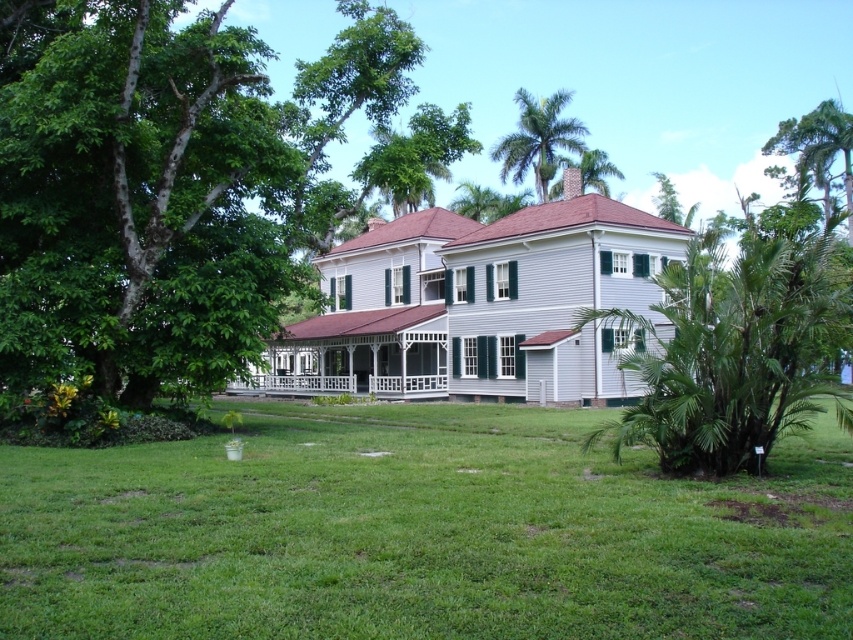
In the scene shown: You are standing in front of the house and want to walk towards the green grass at center and the green leafy palm tree at right. Which object will you step on first?

The green grass at center is closer to the viewer than the green leafy palm tree at right, so you will step on the green grass at center first.

You are a landscape architect designing a garden layout. You need to place a new bench between the green leafy palm tree at right and the green leafy tree at upper center. Which tree should the bench be closer to if you want it to be near the taller tree?

The green leafy tree at upper center is taller than the green leafy palm tree at right, so the bench should be placed closer to the green leafy tree at upper center.